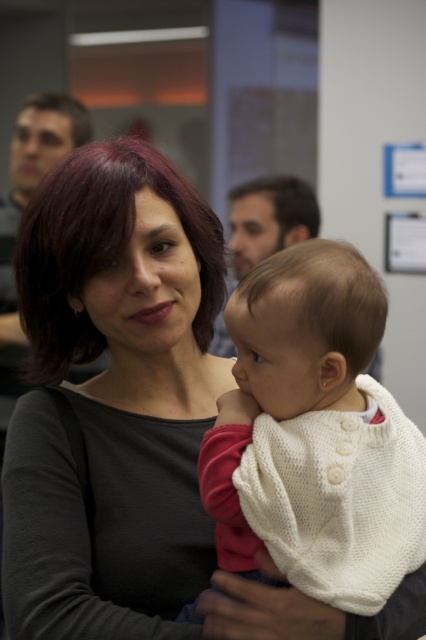
Question: Which point is farther to the camera?

Choices:
 (A) (273, 438)
 (B) (155, 339)

Answer: (B)

Question: Does matte black sweater at center appear on the right side of white knitted sweater at center?

Choices:
 (A) no
 (B) yes

Answer: (A)

Question: Does matte black sweater at center have a larger size compared to white knitted sweater at center?

Choices:
 (A) yes
 (B) no

Answer: (A)

Question: Which point is farther from the camera taking this photo?

Choices:
 (A) (304, 294)
 (B) (187, 246)

Answer: (B)

Question: Which point is farther from the camera taking this photo?

Choices:
 (A) (325, 529)
 (B) (132, 529)

Answer: (B)

Question: Is the position of matte black sweater at center more distant than that of white knitted sweater at center?

Choices:
 (A) yes
 (B) no

Answer: (A)